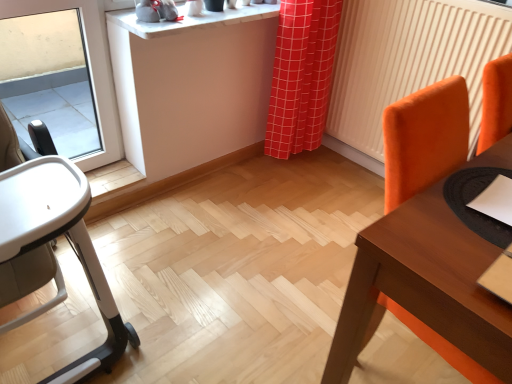
Question: Relative to wooden table at right, is orange fabric radiator at right in front or behind?

Choices:
 (A) front
 (B) behind

Answer: (B)

Question: In terms of height, does orange fabric radiator at right look taller or shorter compared to wooden table at right?

Choices:
 (A) tall
 (B) short

Answer: (A)

Question: Which object is the farthest from the wooden table at right?

Choices:
 (A) beige fabric highchair at left
 (B) orange fabric radiator at right
 (C) white marble counter top at upper center
 (D) red checkered curtain at center

Answer: (C)

Question: Which is farther from the orange fabric radiator at right?

Choices:
 (A) white marble counter top at upper center
 (B) beige fabric highchair at left
 (C) red checkered curtain at center
 (D) wooden table at right

Answer: (B)